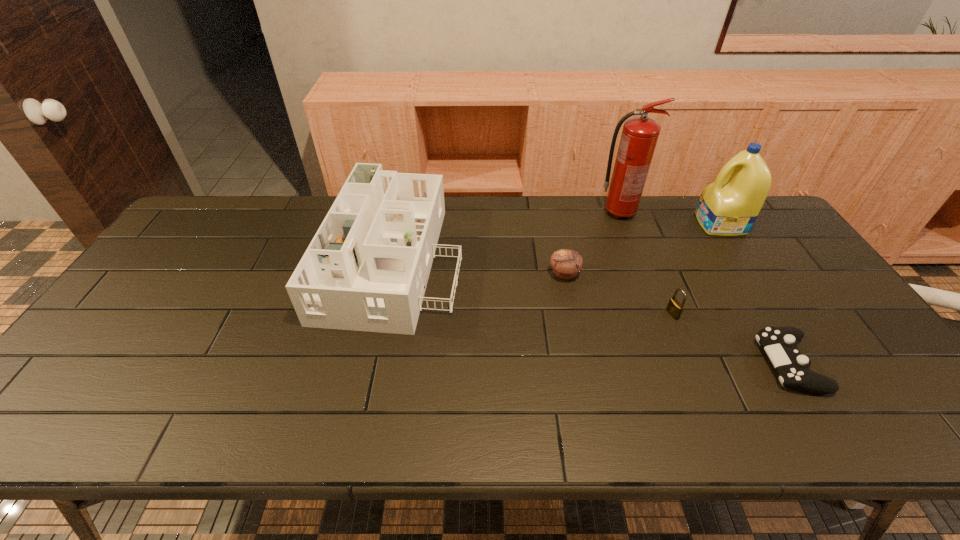
Identify the location of the tallest object. (639, 137).

At what (x,y) coordinates should I click in order to perform the action: click on detergent. Please return your answer as a coordinate pair (x, y). The width and height of the screenshot is (960, 540). Looking at the image, I should click on (729, 206).

Where is `the third tallest object`? the third tallest object is located at coordinates (366, 269).

Identify the location of dollhouse. Image resolution: width=960 pixels, height=540 pixels. (366, 269).

Locate an element on the screen. padlock is located at coordinates (674, 308).

At what (x,y) coordinates should I click in order to perform the action: click on muffin. Please return your answer as a coordinate pair (x, y). Image resolution: width=960 pixels, height=540 pixels. Looking at the image, I should click on (566, 263).

The image size is (960, 540). What are the coordinates of `the shortest object` in the screenshot? It's located at (780, 343).

Locate an element on the screen. The width and height of the screenshot is (960, 540). free space located on the handle side the tallest object is located at coordinates (656, 213).

Find the location of a particular element. The height and width of the screenshot is (540, 960). vacant area situated 0.130m on the label of the fifth shortest object is located at coordinates (659, 224).

Identify the location of free space located 0.310m on the label of the fifth shortest object. The image size is (960, 540). (604, 224).